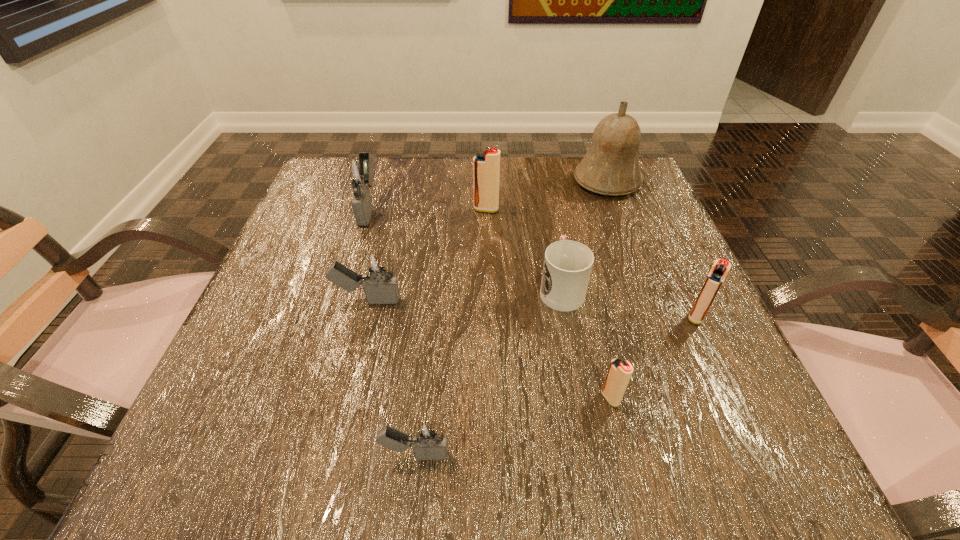
The image size is (960, 540). In order to click on vacant space at the right edge of the desktop in this screenshot , I will do `click(626, 251)`.

The height and width of the screenshot is (540, 960). I want to click on vacant space at the far left corner of the desktop, so click(386, 167).

What are the coordinates of `vacant point located between the cup and the second nearest object` in the screenshot? It's located at (586, 343).

Locate an element on the screen. The image size is (960, 540). unoccupied position between the red cup and the biggest gray igniter is located at coordinates (465, 248).

Locate an element on the screen. The width and height of the screenshot is (960, 540). empty space that is in between the second biggest gray igniter and the nearest igniter is located at coordinates (391, 377).

In order to click on free spot between the bell and the nearest gray igniter in this screenshot , I will do `click(511, 318)`.

In order to click on free spot between the farthest gray igniter and the smallest red igniter in this screenshot , I will do `click(490, 303)`.

Locate an element on the screen. The height and width of the screenshot is (540, 960). free area in between the third igniter from right to left and the red cup is located at coordinates (523, 248).

Locate an element on the screen. The width and height of the screenshot is (960, 540). vacant region between the tallest object and the rightmost igniter is located at coordinates (652, 249).

Identify the location of vacant area that lies between the biggest gray igniter and the fourth object from left to right. The height and width of the screenshot is (540, 960). (427, 208).